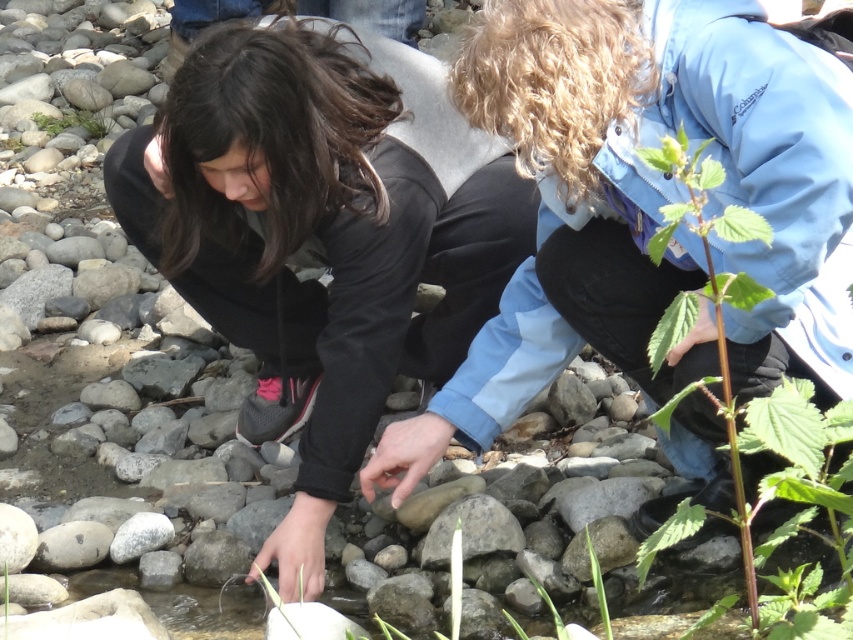
Can you confirm if black matte jacket at center is smaller than green leafy stem at center right?

Actually, black matte jacket at center might be larger than green leafy stem at center right.

Image resolution: width=853 pixels, height=640 pixels. Identify the location of black matte jacket at center. (321, 236).

Between green leafy stem at center right and green leafy plant at upper left, which one appears on the left side from the viewer's perspective?

green leafy plant at upper left is more to the left.

Does green leafy stem at center right have a larger size compared to green leafy plant at upper left?

Yes.

Between point (799, 468) and point (91, 124), which one is positioned behind?

The point (91, 124) is behind.

Locate an element on the screen. green leafy stem at center right is located at coordinates (730, 384).

Is black matte jacket at center closer to camera compared to green leafy plant at upper left?

Yes, it is in front of green leafy plant at upper left.

Is point (152, 204) farther from viewer compared to point (91, 132)?

No, (152, 204) is in front of (91, 132).

Identify the location of black matte jacket at center. (321, 236).